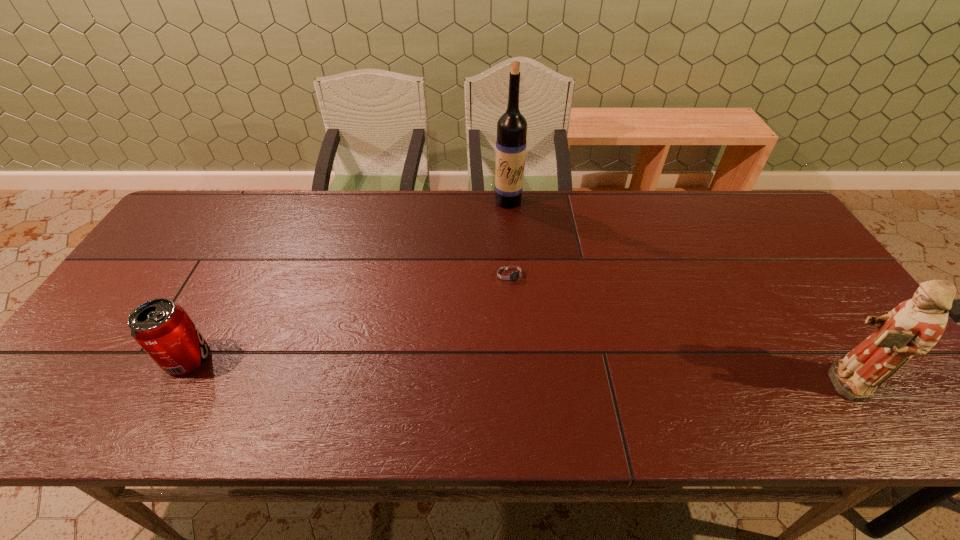
At what (x,y) coordinates should I click in order to perform the action: click on figurine that is positioned at the near edge. Please return your answer as a coordinate pair (x, y). The image size is (960, 540). Looking at the image, I should click on (912, 328).

Locate an element on the screen. The height and width of the screenshot is (540, 960). object that is at the right edge is located at coordinates (912, 328).

Find the location of a particular element. object at the near right corner is located at coordinates (912, 328).

At what (x,y) coordinates should I click in order to perform the action: click on blank space at the far edge of the desktop. Please return your answer as a coordinate pair (x, y). The width and height of the screenshot is (960, 540). Looking at the image, I should click on (488, 224).

This screenshot has height=540, width=960. Identify the location of free region at the near edge of the desktop. (759, 379).

In the image, there is a desktop. Where is `vacant space at the left edge`? The height and width of the screenshot is (540, 960). vacant space at the left edge is located at coordinates (143, 293).

In the image, there is a desktop. Identify the location of vacant space at the right edge. This screenshot has height=540, width=960. (817, 266).

Locate an element on the screen. free region at the far left corner is located at coordinates (242, 197).

The width and height of the screenshot is (960, 540). I want to click on free space at the far right corner of the desktop, so click(715, 194).

You are a GUI agent. You are given a task and a screenshot of the screen. Output one action in this format:
    pyautogui.click(x=<x>, y=<y>)
    Task: Click on the free space between the figurine and the shortest object
    
    Given the screenshot: What is the action you would take?
    pyautogui.click(x=675, y=328)